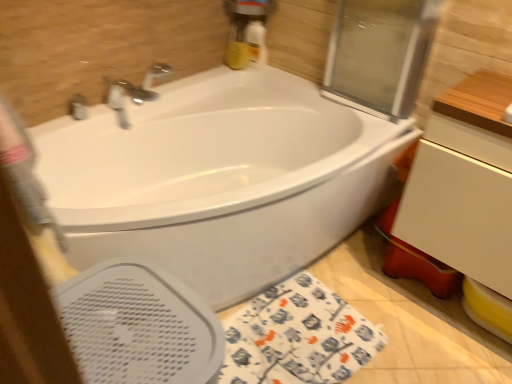
Question: In terms of height, does matte silver faucet at upper left look taller or shorter compared to white glossy bathtub at center?

Choices:
 (A) tall
 (B) short

Answer: (B)

Question: From the image's perspective, relative to white glossy bathtub at center, is matte silver faucet at upper left above or below?

Choices:
 (A) above
 (B) below

Answer: (A)

Question: Considering the real-world distances, which object is closest to the transparent glass screen door at upper right?

Choices:
 (A) white matte drawer at right
 (B) white glossy bathtub at center
 (C) white fabric beach towel at lower center
 (D) white perforated bidet at lower left
 (E) matte silver faucet at upper left

Answer: (B)

Question: Which of these objects is positioned farthest from the transparent glass screen door at upper right?

Choices:
 (A) white matte drawer at right
 (B) white fabric beach towel at lower center
 (C) matte silver faucet at upper left
 (D) white perforated bidet at lower left
 (E) white glossy bathtub at center

Answer: (D)